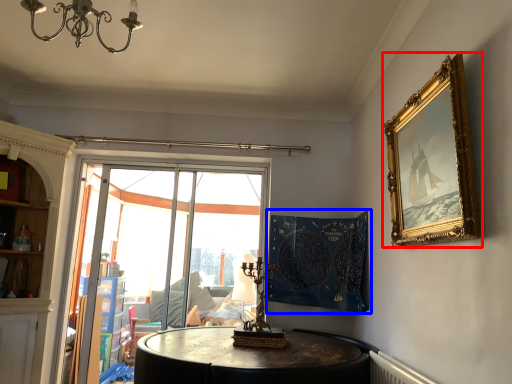
Question: Which object is further to the camera taking this photo, picture frame (highlighted by a red box) or tapestry (highlighted by a blue box)?

Choices:
 (A) picture frame
 (B) tapestry

Answer: (B)